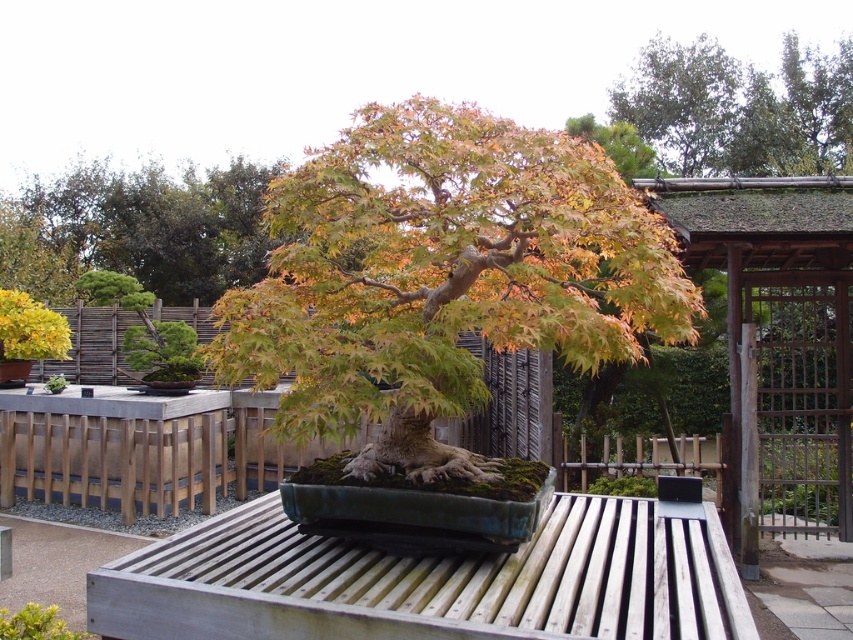
Question: Which point is farther to the camera?

Choices:
 (A) (108, 186)
 (B) (282, 257)

Answer: (A)

Question: Is shiny orange-brown bonsai tree at center thinner than orange-brown bark tree at upper center?

Choices:
 (A) no
 (B) yes

Answer: (A)

Question: Where is shiny orange-brown bonsai tree at center located in relation to orange-brown bark tree at upper center in the image?

Choices:
 (A) left
 (B) right

Answer: (B)

Question: Is shiny orange-brown bonsai tree at center closer to camera compared to orange-brown bark tree at upper center?

Choices:
 (A) no
 (B) yes

Answer: (B)